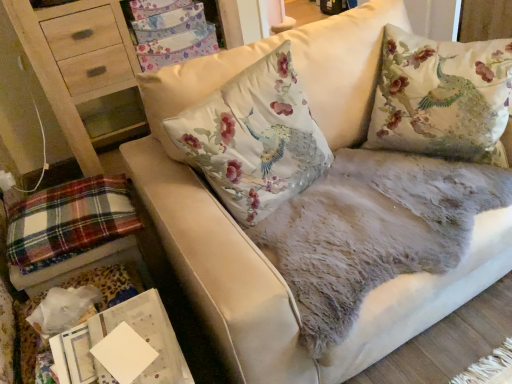
Question: Relative to floral fabric cushion at upper right, is floral fabric cushion at center, the 1th pillow when ordered from left to right, in front or behind?

Choices:
 (A) behind
 (B) front

Answer: (B)

Question: In terms of width, does floral fabric cushion at center, positioned as the second pillow in right-to-left order, look wider or thinner when compared to floral fabric cushion at upper right?

Choices:
 (A) thin
 (B) wide

Answer: (A)

Question: Estimate the real-world distances between objects in this image. Which object is closer to the floral fabric cushion at upper right?

Choices:
 (A) silky floral pillow at upper right, the 2th pillow when ordered from left to right
 (B) plaid fabric at lower left
 (C) white paper at lower left
 (D) floral fabric cushion at center, positioned as the second pillow in right-to-left order

Answer: (B)

Question: Which is nearer to the white paper at lower left?

Choices:
 (A) plaid fabric at lower left
 (B) floral fabric cushion at center, the 1th pillow when ordered from left to right
 (C) floral fabric cushion at upper right
 (D) silky floral pillow at upper right, the 2th pillow when ordered from left to right

Answer: (A)